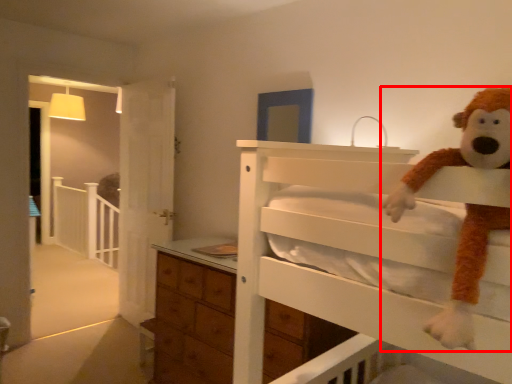
Question: In this image, where is toy (annotated by the red box) located relative to balustrade?

Choices:
 (A) left
 (B) right

Answer: (B)